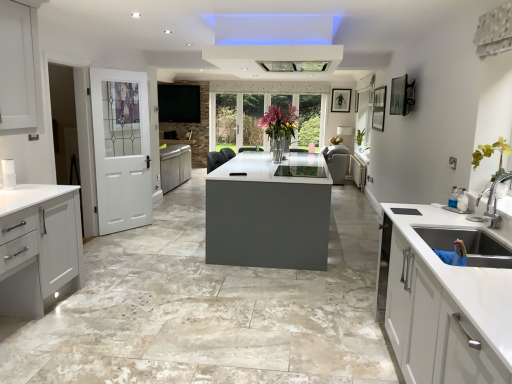
Question: Is translucent glass vase at center taller or shorter than white glossy concrete at center?

Choices:
 (A) short
 (B) tall

Answer: (B)

Question: Considering their positions, is translucent glass vase at center located in front of or behind white glossy concrete at center?

Choices:
 (A) front
 (B) behind

Answer: (B)

Question: Based on their relative distances, which object is farther from the white matte cabinet at center, which is the 2th cabinetry in front-to-back order?

Choices:
 (A) white glossy concrete at center
 (B) translucent glass vase at center
 (C) white painted wood door at left
 (D) matte white cabinet at left, which is the first cabinetry in left-to-right order

Answer: (D)

Question: Estimate the real-world distances between objects in this image. Which object is closer to the white matte cabinet at center, the first cabinetry positioned from the back?

Choices:
 (A) white glossy concrete at center
 (B) matte white cabinet at left, the second cabinetry positioned from the top
 (C) white painted wood door at left
 (D) translucent glass vase at center

Answer: (D)